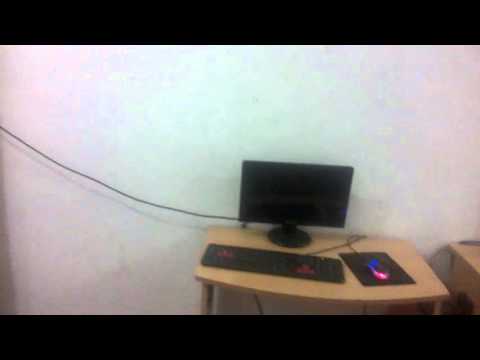
Locate an element on the screen. The image size is (480, 360). keyboard is located at coordinates (280, 264).